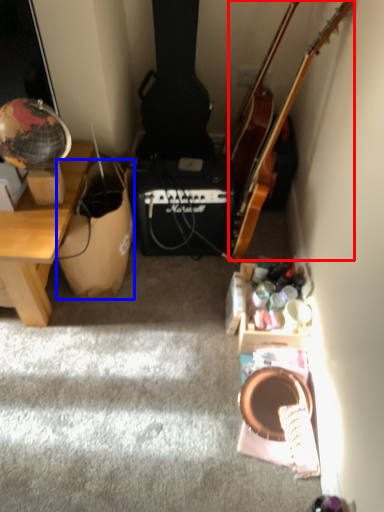
Question: Which object appears closest to the camera in this image, guitar (highlighted by a red box) or cardboard box (highlighted by a blue box)?

Choices:
 (A) guitar
 (B) cardboard box

Answer: (A)